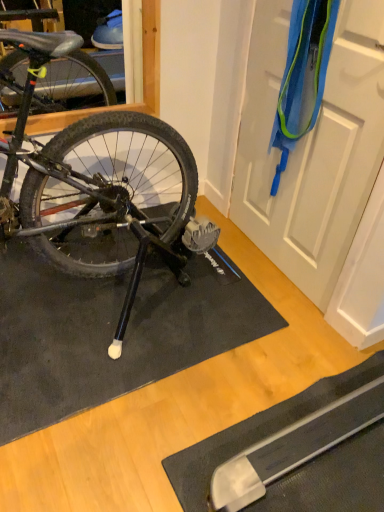
The image size is (384, 512). Find the location of `vacant space positioned to the left of white matte door at upper right`. vacant space positioned to the left of white matte door at upper right is located at coordinates [x=235, y=258].